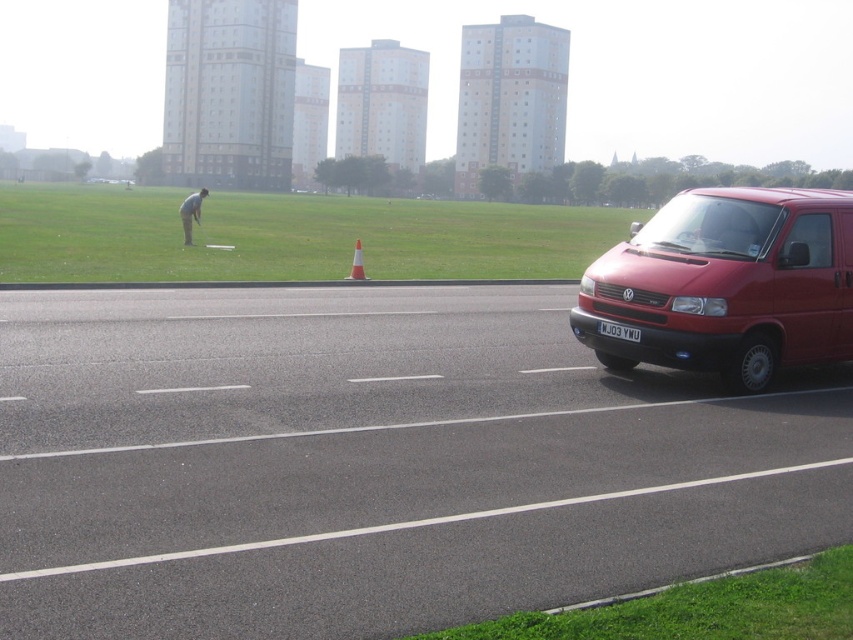
Question: Is matte red van at right further to camera compared to black plastic license plate at center?

Choices:
 (A) no
 (B) yes

Answer: (A)

Question: Which object appears closest to the camera in this image?

Choices:
 (A) matte red van at right
 (B) smooth gray shirt at center
 (C) orange cone at center
 (D) black plastic license plate at center

Answer: (A)

Question: Does matte red van at right have a larger size compared to smooth gray shirt at center?

Choices:
 (A) no
 (B) yes

Answer: (A)

Question: Which object is positioned farthest from the smooth gray shirt at center?

Choices:
 (A) black plastic license plate at center
 (B) orange cone at center

Answer: (A)

Question: Which point is closer to the camera taking this photo?

Choices:
 (A) (645, 248)
 (B) (361, 248)
 (C) (604, 324)

Answer: (C)

Question: From the image, what is the correct spatial relationship of matte red van at right in relation to black plastic license plate at center?

Choices:
 (A) left
 (B) right

Answer: (B)